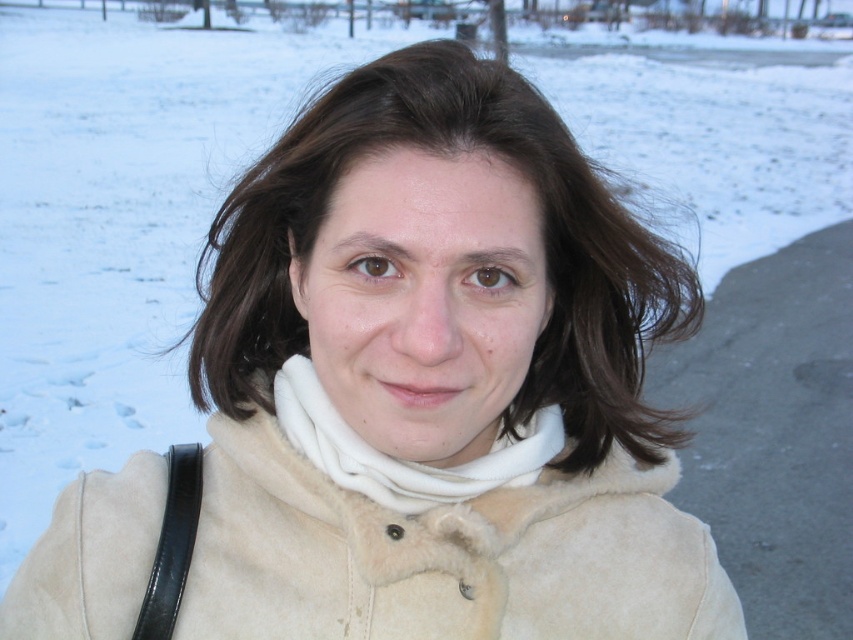
Is point (224, 554) behind point (325, 152)?

Yes, it is.

Who is more forward, (x=247, y=579) or (x=509, y=84)?

Point (x=509, y=84) is in front.

Find the location of a particular element. beige suede coat at center is located at coordinates (444, 556).

Between brownwoollyhair at center and white fleece scarf at center, which one appears on the right side from the viewer's perspective?

white fleece scarf at center

Does brownwoollyhair at center have a larger size compared to white fleece scarf at center?

Yes.

Is point (271, 196) less distant than point (486, 467)?

Yes, it is.

Where is `brownwoollyhair at center`? brownwoollyhair at center is located at coordinates (544, 236).

Does beige suede coat at center have a greater height compared to white fleece scarf at center?

Yes.

Measure the distance between point (531, 518) and camera.

Point (531, 518) and camera are 33.06 inches apart.

Which is in front, point (135, 464) or point (503, 480)?

Positioned in front is point (503, 480).

Locate an element on the screen. The width and height of the screenshot is (853, 640). beige suede coat at center is located at coordinates (444, 556).